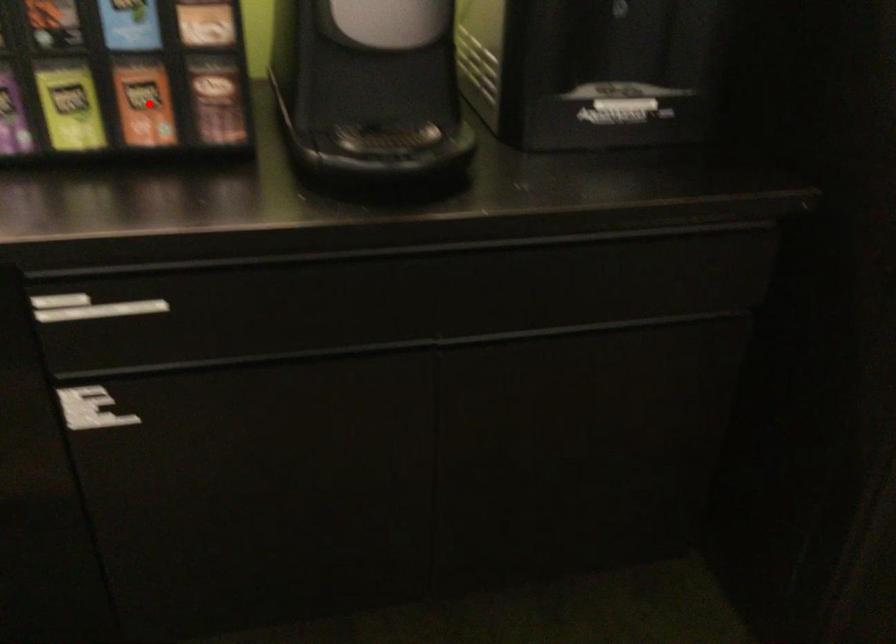
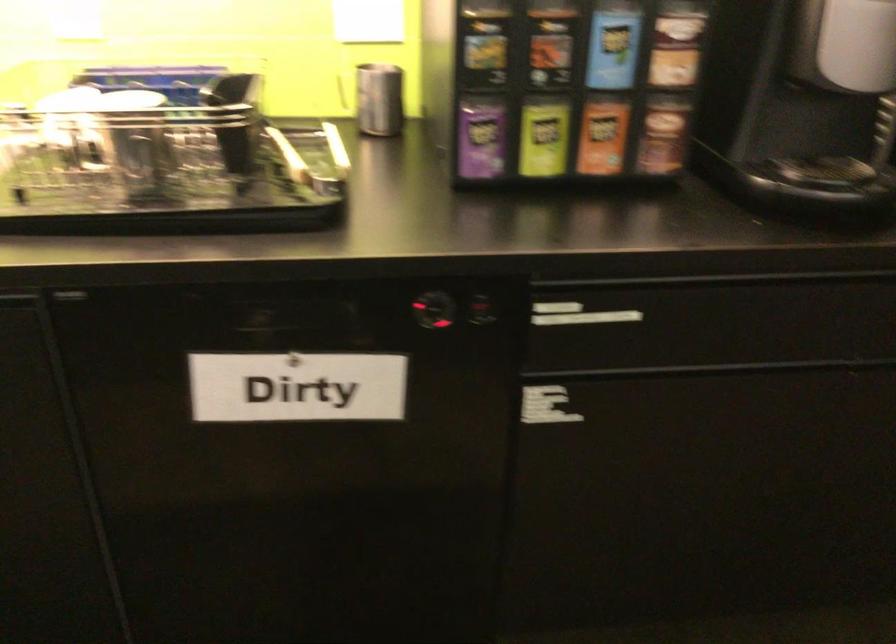
Find the pixel in the second image that matches the highlighted location in the first image.

(602, 136)